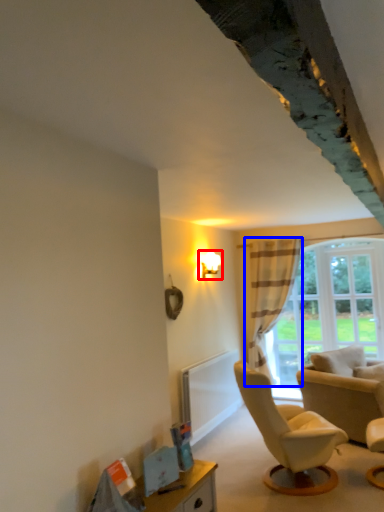
Question: Which point is closer to the camera, light fixture (highlighted by a red box) or curtain (highlighted by a blue box)?

Choices:
 (A) light fixture
 (B) curtain

Answer: (A)